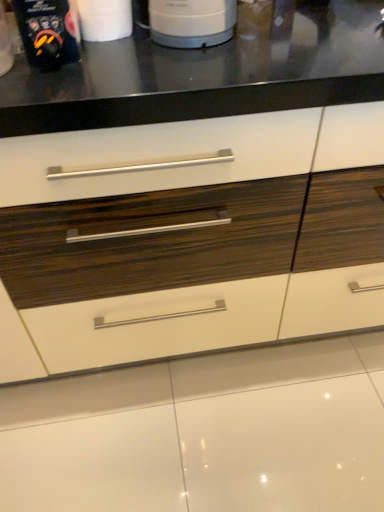
Identify the location of vacant area that lies to the right of white matte paper towel at upper left. (210, 52).